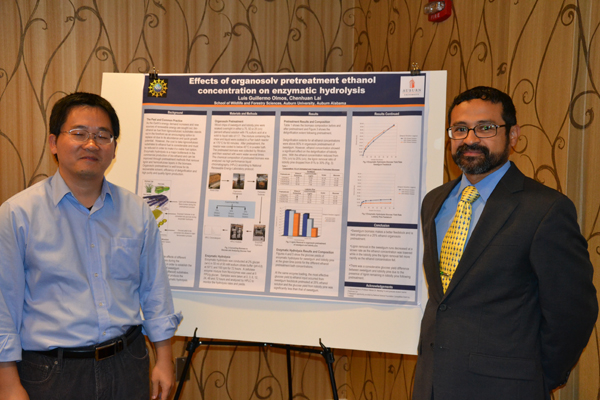
The height and width of the screenshot is (400, 600). I want to click on poster, so click(x=360, y=129).